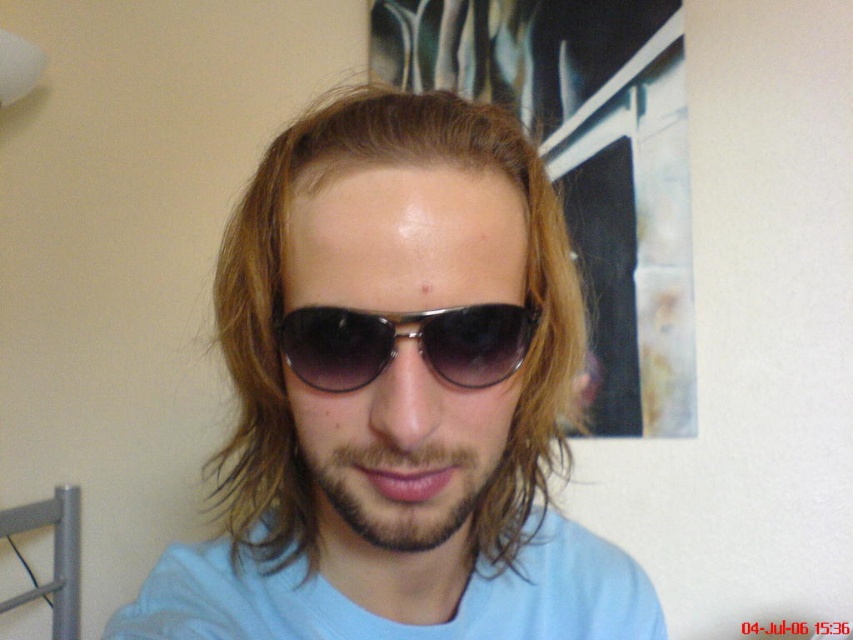
Question: Based on their relative distances, which object is nearer to the brown matte hair at center?

Choices:
 (A) dark brown stubble at center
 (B) light blue cotton shirt at center
 (C) black metallic sunglasses at center

Answer: (B)

Question: Which object is the farthest from the light blue cotton shirt at center?

Choices:
 (A) dark brown stubble at center
 (B) black metallic sunglasses at center
 (C) brown matte hair at center

Answer: (B)

Question: Which point appears closest to the camera in this image?

Choices:
 (A) (351, 372)
 (B) (376, 506)
 (C) (332, 125)
 (D) (300, 627)

Answer: (A)

Question: Does brown matte hair at center appear on the right side of dark brown stubble at center?

Choices:
 (A) yes
 (B) no

Answer: (A)

Question: Is light blue cotton shirt at center to the right of black metallic sunglasses at center from the viewer's perspective?

Choices:
 (A) yes
 (B) no

Answer: (A)

Question: Is black metallic sunglasses at center positioned before dark brown stubble at center?

Choices:
 (A) yes
 (B) no

Answer: (A)